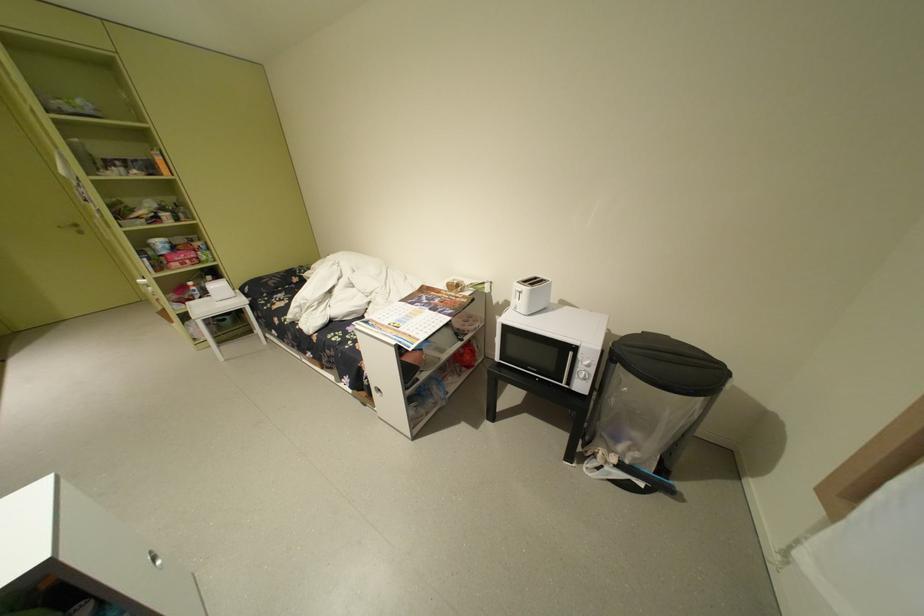
This screenshot has width=924, height=616. Find the location of `white toaster`. white toaster is located at coordinates (530, 294).